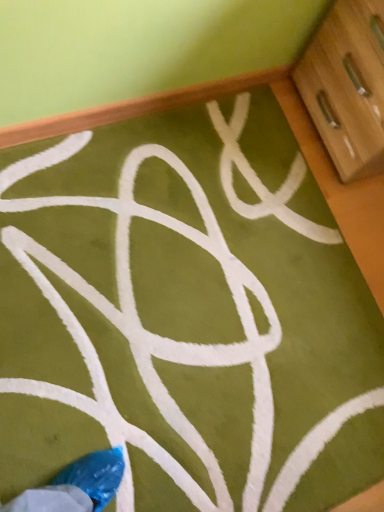
What do you see at coordinates (347, 86) in the screenshot?
I see `wooden chest of drawers at upper right` at bounding box center [347, 86].

The height and width of the screenshot is (512, 384). What are the coordinates of `wooden chest of drawers at upper right` in the screenshot? It's located at (347, 86).

Locate an element on the screen. The height and width of the screenshot is (512, 384). wooden chest of drawers at upper right is located at coordinates (347, 86).